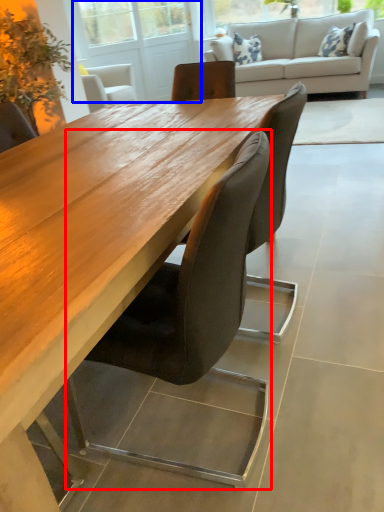
Question: Which point is closer to the camera, chair (highlighted by a red box) or screen door (highlighted by a blue box)?

Choices:
 (A) chair
 (B) screen door

Answer: (A)